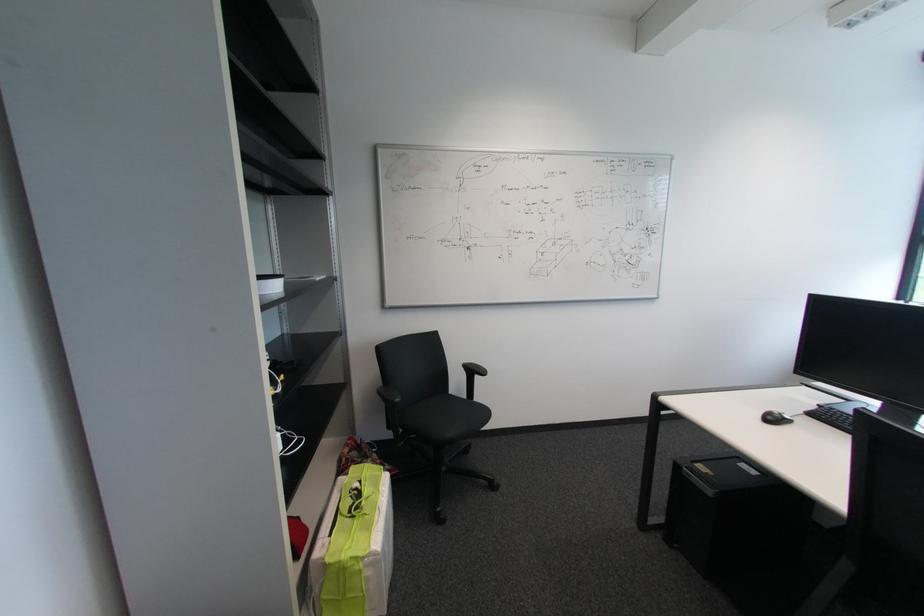
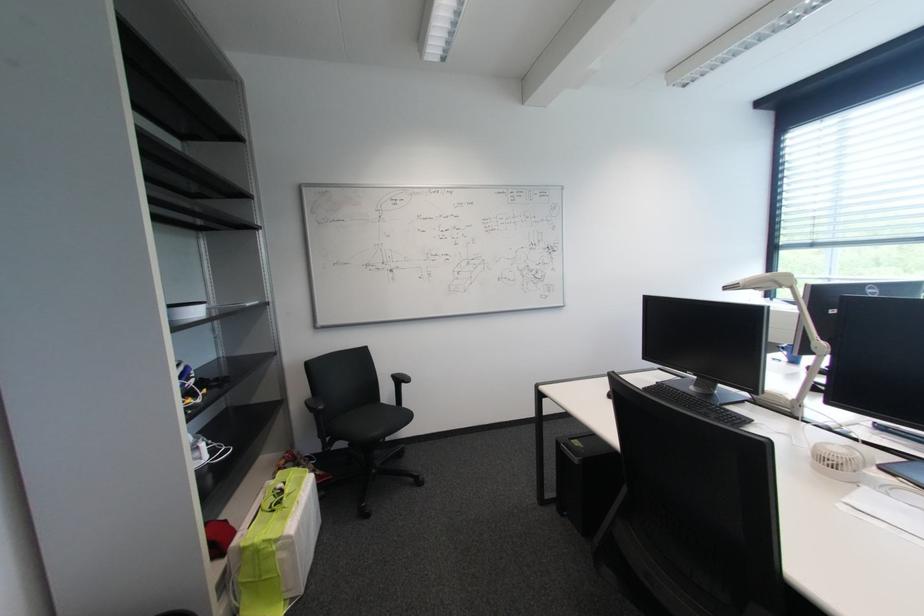
Question: Based on the continuous images, in which direction is the camera rotating? Reply with the corresponding letter.

Choices:
 (A) Left
 (B) Right
 (C) Up
 (D) Down

Answer: (B)